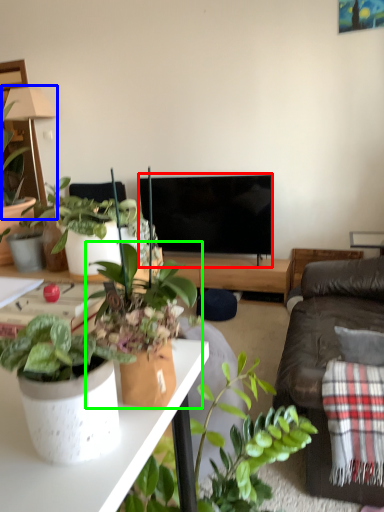
Question: Which object is the closest to the television (highlighted by a red box)? Choose among these: lamp (highlighted by a blue box) or houseplant (highlighted by a green box).

Choices:
 (A) lamp
 (B) houseplant

Answer: (A)